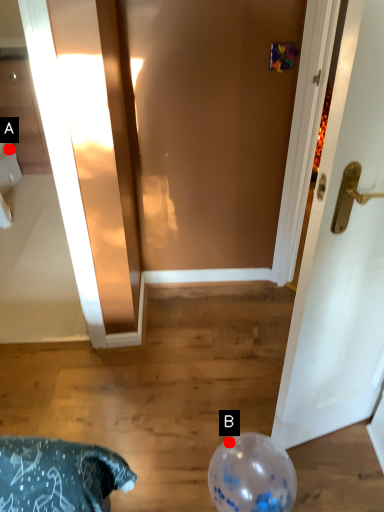
Question: Two points are circled on the image, labeled by A and B beside each circle. Which point is closer to the camera taking this photo?

Choices:
 (A) A is closer
 (B) B is closer

Answer: (B)